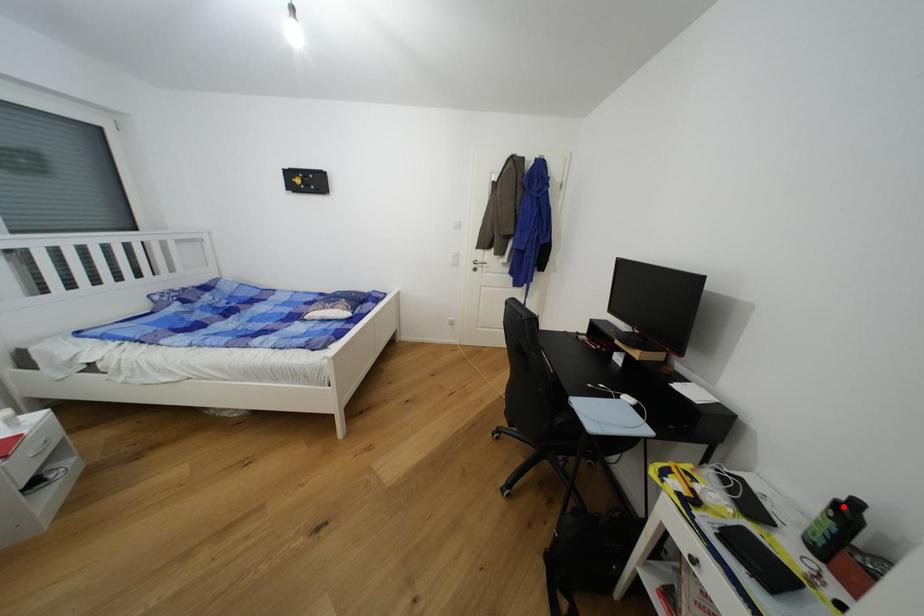
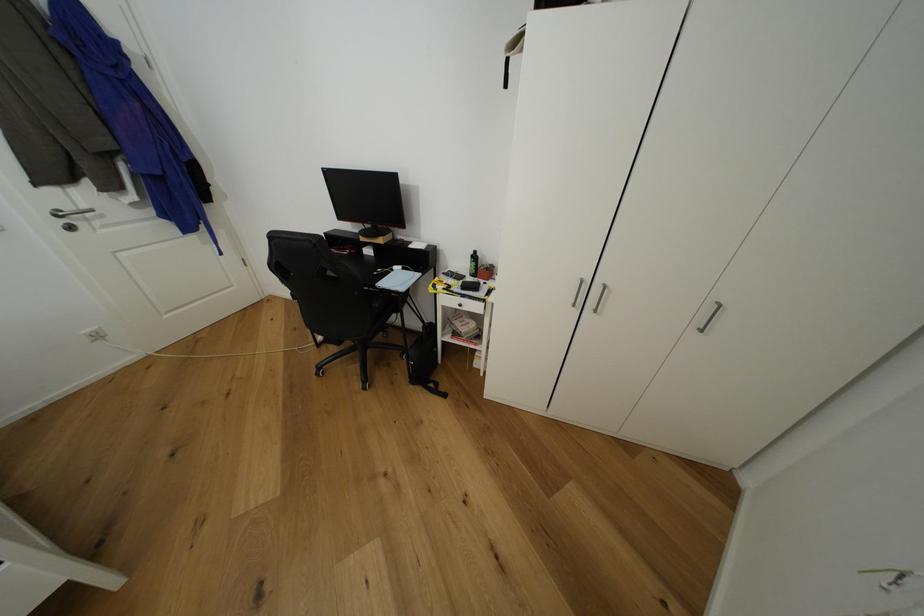
In the second image, find the point that corresponds to the highlighted location in the first image.

(478, 257)